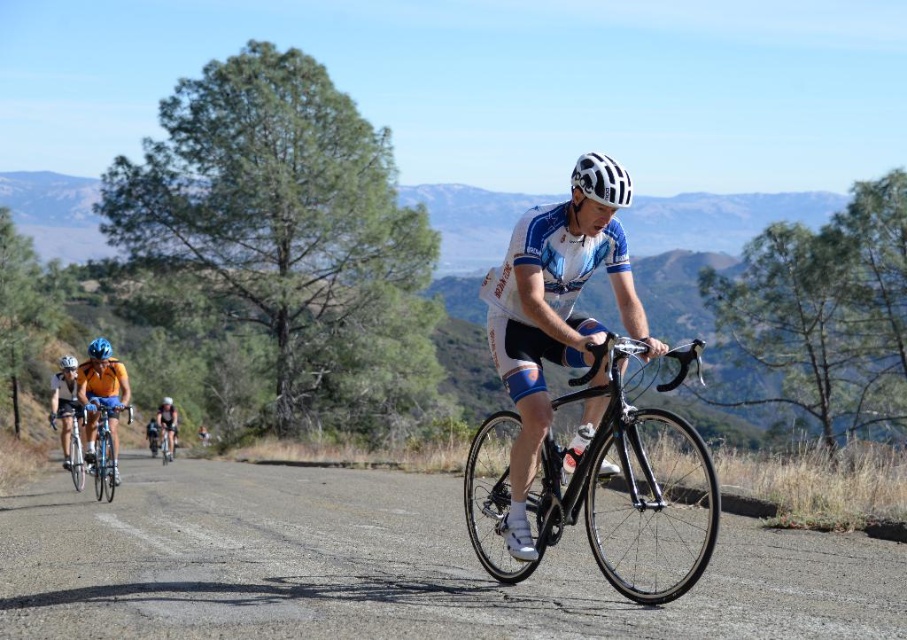
Question: Can you confirm if white matte cycling jersey at center is thinner than orange jersey cyclist at left?

Choices:
 (A) no
 (B) yes

Answer: (B)

Question: Which is nearer to the black rubber road bike at center?

Choices:
 (A) white matte bicycle helmet at center
 (B) shiny silver bicycle at center
 (C) black glossy road bike at center

Answer: (C)

Question: Which object appears farthest from the camera in this image?

Choices:
 (A) black rubber road bike at center
 (B) shiny blue bicycle at center
 (C) matte blue helmet at upper left
 (D) orange jersey cyclist at left

Answer: (C)

Question: Which of the following is the closest to the observer?

Choices:
 (A) shiny blue bicycle at center
 (B) black glossy road bike at center

Answer: (B)

Question: Is black rubber road bike at center further to camera compared to black glossy road bike at center?

Choices:
 (A) yes
 (B) no

Answer: (A)

Question: Can you confirm if orange jersey cyclist at left is positioned above shiny silver bicycle at center?

Choices:
 (A) yes
 (B) no

Answer: (A)